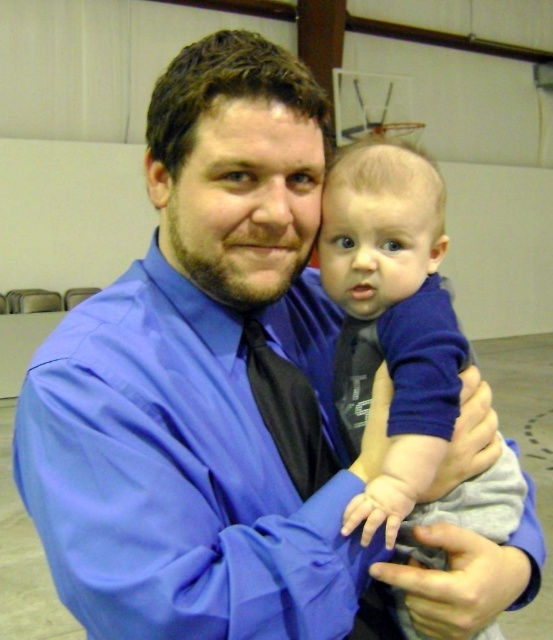
Question: Is blue soft baby at center closer to camera compared to black satin tie at center?

Choices:
 (A) yes
 (B) no

Answer: (A)

Question: Is blue soft baby at center above black satin tie at center?

Choices:
 (A) no
 (B) yes

Answer: (B)

Question: Among these points, which one is farthest from the camera?

Choices:
 (A) (322, 470)
 (B) (418, 392)

Answer: (A)

Question: Does blue soft baby at center appear over black satin tie at center?

Choices:
 (A) yes
 (B) no

Answer: (A)